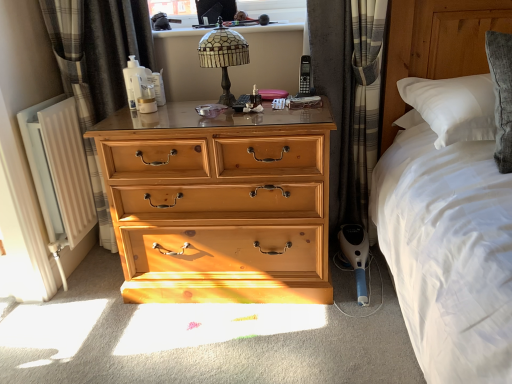
I want to click on wooden chest of drawers at center, so click(219, 204).

Describe the element at coordinates (241, 102) in the screenshot. The image size is (512, 384). I see `black plastic remote control at center` at that location.

Measure the distance between point [242,111] and camera.

Point [242,111] is 5.38 feet from camera.

Measure the distance between point (210,42) and camera.

A distance of 1.60 meters exists between point (210,42) and camera.

What do you see at coordinates (223, 55) in the screenshot? The image size is (512, 384). I see `stained glass lampshade at upper center` at bounding box center [223, 55].

What are the coordinates of `plaid fabric curtain at right, which is the second curtain from left to right` in the screenshot? It's located at (349, 96).

In terms of height, does black plastic remote control at center look taller or shorter compared to stained glass lampshade at upper center?

In the image, black plastic remote control at center appears to be shorter than stained glass lampshade at upper center.

Is black plastic remote control at center not near stained glass lampshade at upper center?

black plastic remote control at center is near stained glass lampshade at upper center, not far away.

Between black plastic remote control at center and stained glass lampshade at upper center, which one has larger width?

black plastic remote control at center is wider.

I want to click on remote control behind the stained glass lampshade at upper center, so click(241, 102).

Which of these two, stained glass lampshade at upper center or plaid fabric curtain at right, which is the second curtain from left to right, is wider?

With larger width is plaid fabric curtain at right, which is the second curtain from left to right.

Considering the relative sizes of stained glass lampshade at upper center and plaid fabric curtain at right, the first curtain viewed from the right, in the image provided, is stained glass lampshade at upper center smaller than plaid fabric curtain at right, the first curtain viewed from the right,?

Yes.

Does stained glass lampshade at upper center lie in front of plaid fabric curtain at right, which is the second curtain from left to right?

Yes, stained glass lampshade at upper center is in front of plaid fabric curtain at right, which is the second curtain from left to right.

Can you tell me how much stained glass lampshade at upper center and plaid fabric curtain at right, the first curtain viewed from the right, differ in facing direction?

They differ by 0.77 degrees in their facing directions.

Can you confirm if white painted metal radiator at left is positioned to the right of gray plaid curtain at left, which appears as the 2th curtain when viewed from the right?

No.

Which of these two, white painted metal radiator at left or gray plaid curtain at left, which appears as the 2th curtain when viewed from the right, is bigger?

gray plaid curtain at left, which appears as the 2th curtain when viewed from the right, is bigger.

Where is `radiator that appears below the gray plaid curtain at left, arranged as the 1th curtain when viewed from the left (from the image's perspective)`? radiator that appears below the gray plaid curtain at left, arranged as the 1th curtain when viewed from the left (from the image's perspective) is located at coordinates [59, 168].

From the image's perspective, which is below, white painted metal radiator at left or gray plaid curtain at left, which appears as the 2th curtain when viewed from the right?

white painted metal radiator at left.

Is stained glass lampshade at upper center to the right of black plastic remote control at center from the viewer's perspective?

No.

Considering the sizes of objects stained glass lampshade at upper center and black plastic remote control at center in the image provided, who is bigger, stained glass lampshade at upper center or black plastic remote control at center?

With larger size is stained glass lampshade at upper center.

From a real-world perspective, is stained glass lampshade at upper center on top of black plastic remote control at center?

Yes, from a real-world perspective, stained glass lampshade at upper center is over black plastic remote control at center

Relative to black plastic remote control at center, is stained glass lampshade at upper center in front or behind?

Visually, stained glass lampshade at upper center is located in front of black plastic remote control at center.

Considering the sizes of objects wooden chest of drawers at center and white painted metal radiator at left in the image provided, who is smaller, wooden chest of drawers at center or white painted metal radiator at left?

With smaller size is white painted metal radiator at left.

How different are the orientations of wooden chest of drawers at center and white painted metal radiator at left in degrees?

The facing directions of wooden chest of drawers at center and white painted metal radiator at left are 90.7 degrees apart.

Is wooden chest of drawers at center placed right next to white painted metal radiator at left?

They are not placed beside each other.

Which is correct: wooden chest of drawers at center is inside white painted metal radiator at left, or outside of it?

wooden chest of drawers at center is located beyond the bounds of white painted metal radiator at left.

Visually, is gray plaid curtain at left, which appears as the 2th curtain when viewed from the right, positioned to the left or to the right of stained glass lampshade at upper center?

gray plaid curtain at left, which appears as the 2th curtain when viewed from the right, is to the left of stained glass lampshade at upper center.

Looking at this image, in terms of width, does gray plaid curtain at left, which appears as the 2th curtain when viewed from the right, look wider or thinner when compared to stained glass lampshade at upper center?

Clearly, gray plaid curtain at left, which appears as the 2th curtain when viewed from the right, has less width compared to stained glass lampshade at upper center.

Which point is more forward, [79,38] or [208,54]?

Positioned in front is point [208,54].

Consider the image. Which object is more forward, gray plaid curtain at left, arranged as the 1th curtain when viewed from the left, or stained glass lampshade at upper center?

Positioned in front is stained glass lampshade at upper center.

Which object is further away from the camera taking this photo, gray plaid curtain at left, arranged as the 1th curtain when viewed from the left, or white painted metal radiator at left?

white painted metal radiator at left is further away from the camera.

From the image's perspective, is gray plaid curtain at left, which appears as the 2th curtain when viewed from the right, over white painted metal radiator at left?

Yes.

Is gray plaid curtain at left, arranged as the 1th curtain when viewed from the left, facing towards white painted metal radiator at left?

No.

The height and width of the screenshot is (384, 512). Find the location of `lamp on the left side of black plastic remote control at center`. lamp on the left side of black plastic remote control at center is located at coordinates tap(223, 55).

Which curtain is the 2nd one when counting from the back of the stained glass lampshade at upper center? Please provide its 2D coordinates.

[(349, 96)]

Considering their positions, is stained glass lampshade at upper center positioned further to black plastic remote control at center than wooden chest of drawers at center?

Based on the image, wooden chest of drawers at center appears to be further to black plastic remote control at center.

Based on their spatial positions, is black plastic remote control at center or stained glass lampshade at upper center further from white painted metal radiator at left?

black plastic remote control at center is positioned further to the anchor white painted metal radiator at left.

Estimate the real-world distances between objects in this image. Which object is further from gray plaid curtain at left, which appears as the 2th curtain when viewed from the right, stained glass lampshade at upper center or wooden chest of drawers at center?

Among the two, wooden chest of drawers at center is located further to gray plaid curtain at left, which appears as the 2th curtain when viewed from the right.

Looking at the image, which one is located further to black plastic remote control at center, stained glass lampshade at upper center or plaid fabric curtain at right, which is the second curtain from left to right?

plaid fabric curtain at right, which is the second curtain from left to right, lies further to black plastic remote control at center than the other object.

Looking at the image, which one is located closer to gray plaid curtain at left, which appears as the 2th curtain when viewed from the right, stained glass lampshade at upper center or plaid fabric curtain at right, the first curtain viewed from the right?

stained glass lampshade at upper center is positioned closer to the anchor gray plaid curtain at left, which appears as the 2th curtain when viewed from the right.

When comparing their distances from stained glass lampshade at upper center, does plaid fabric curtain at right, which is the second curtain from left to right, or white painted metal radiator at left seem further?

The object further to stained glass lampshade at upper center is white painted metal radiator at left.

When comparing their distances from gray plaid curtain at left, arranged as the 1th curtain when viewed from the left, does wooden chest of drawers at center or plaid fabric curtain at right, which is the second curtain from left to right, seem further?

plaid fabric curtain at right, which is the second curtain from left to right, lies further to gray plaid curtain at left, arranged as the 1th curtain when viewed from the left, than the other object.

Looking at this image, based on their spatial positions, is stained glass lampshade at upper center or black plastic remote control at center closer to white painted metal radiator at left?

The object closer to white painted metal radiator at left is stained glass lampshade at upper center.

In order to click on the chest of drawers situated between white painted metal radiator at left and black plastic remote control at center from left to right in this screenshot , I will do `click(219, 204)`.

I want to click on lamp between gray plaid curtain at left, which appears as the 2th curtain when viewed from the right, and black plastic remote control at center from left to right, so click(x=223, y=55).

At what (x,y) coordinates should I click in order to perform the action: click on remote control situated between gray plaid curtain at left, arranged as the 1th curtain when viewed from the left, and plaid fabric curtain at right, which is the second curtain from left to right, from left to right. Please return your answer as a coordinate pair (x, y). The height and width of the screenshot is (384, 512). Looking at the image, I should click on (241, 102).

I want to click on remote control between stained glass lampshade at upper center and wooden chest of drawers at center in the up-down direction, so click(241, 102).